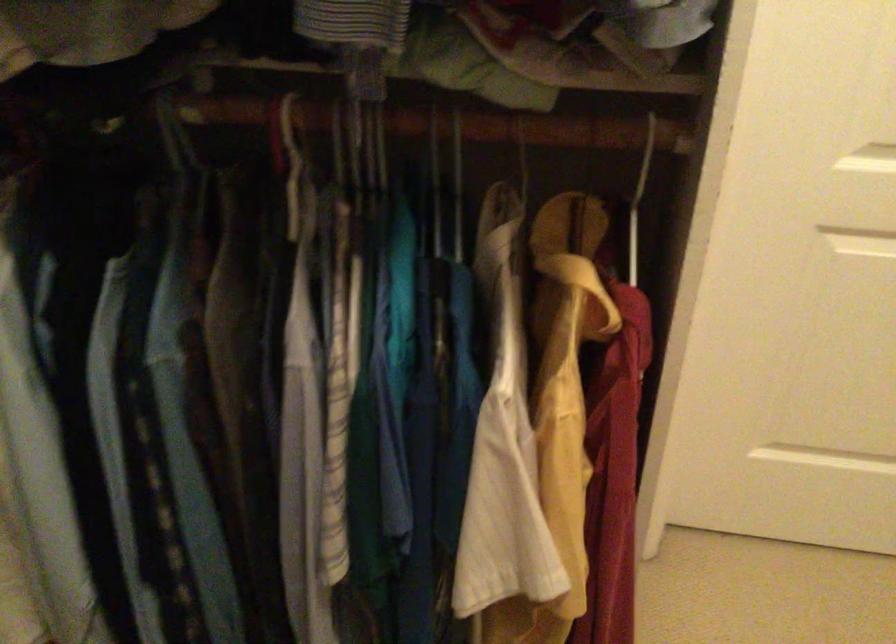
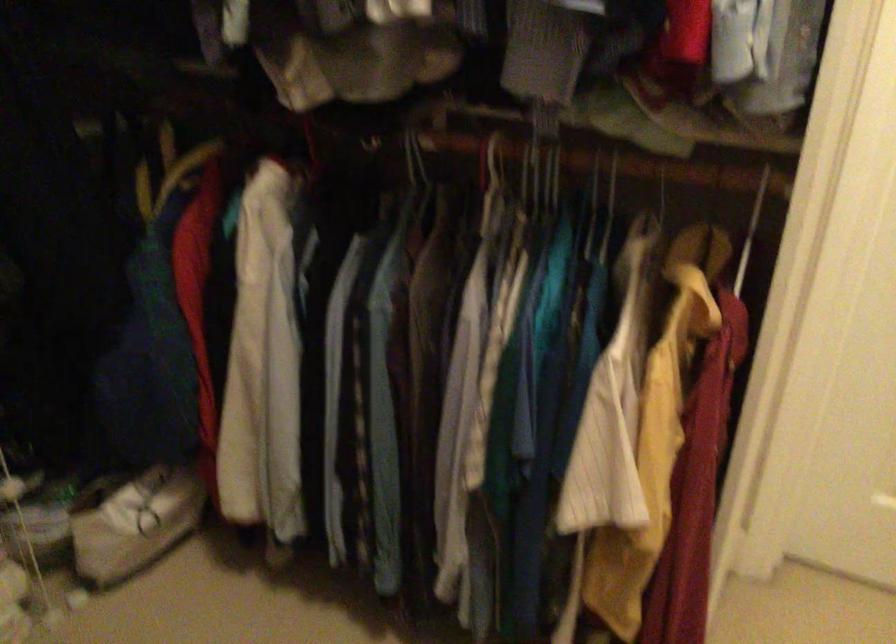
The point at (293, 137) is marked in the first image. Where is the corresponding point in the second image?

(494, 161)